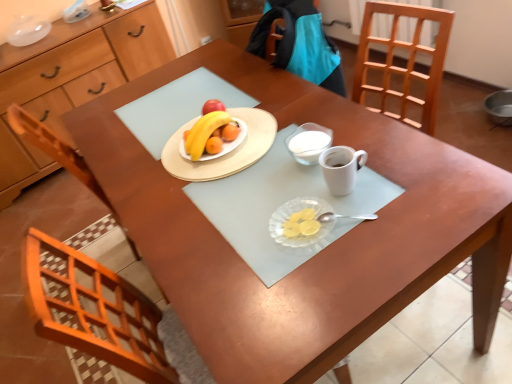
Question: From the image's perspective, is white glass bowl at center located above or below matte wooden plate at center?

Choices:
 (A) below
 (B) above

Answer: (A)

Question: Is white glass bowl at center in front of or behind matte wooden plate at center in the image?

Choices:
 (A) behind
 (B) front

Answer: (B)

Question: Considering the real-world distances, which object is closest to the white glass bowl at center?

Choices:
 (A) matte wood cabinet at left
 (B) transparent glass plate at center
 (C) yellow matte grapefruit at center
 (D) matte wooden plate at center
 (E) white matte coffee cup at center

Answer: (E)

Question: Estimate the real-world distances between objects in this image. Which object is farther from the matte wood cabinet at left?

Choices:
 (A) white matte coffee cup at center
 (B) yellow matte grapefruit at center
 (C) matte wooden plate at center
 (D) transparent glass plate at center
 (E) white glass bowl at center

Answer: (A)